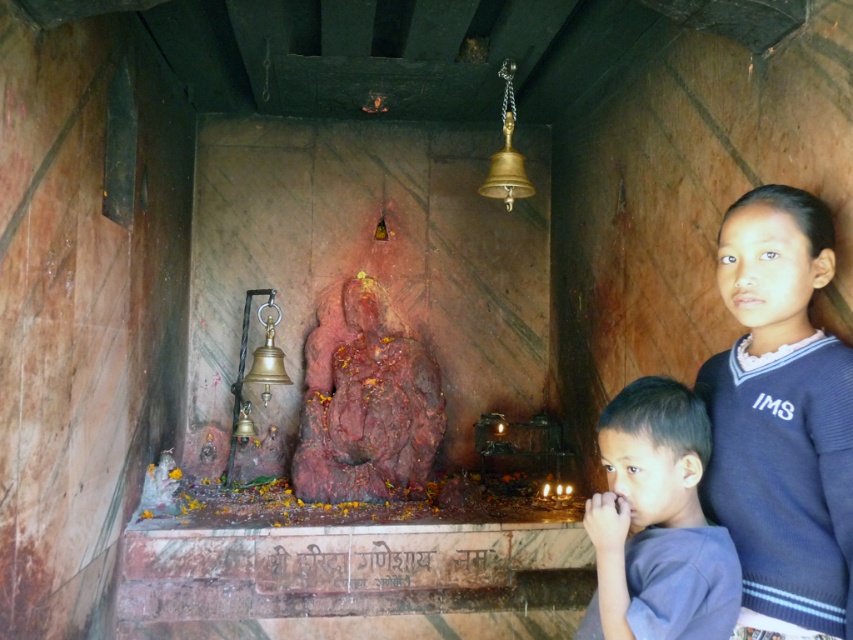
Question: Does blue knitted sweater at right appear under gray cotton shirt at lower right?

Choices:
 (A) yes
 (B) no

Answer: (B)

Question: Does blue knitted sweater at right appear over gray cotton shirt at lower right?

Choices:
 (A) no
 (B) yes

Answer: (B)

Question: Which point is farther from the camera taking this photo?

Choices:
 (A) (827, 509)
 (B) (701, 525)

Answer: (A)

Question: Which point is farther from the camera taking this photo?

Choices:
 (A) (653, 477)
 (B) (775, 246)

Answer: (B)

Question: Which object appears farthest from the camera in this image?

Choices:
 (A) gray cotton shirt at lower right
 (B) blue knitted sweater at right

Answer: (B)

Question: Can you confirm if blue knitted sweater at right is positioned below gray cotton shirt at lower right?

Choices:
 (A) yes
 (B) no

Answer: (B)